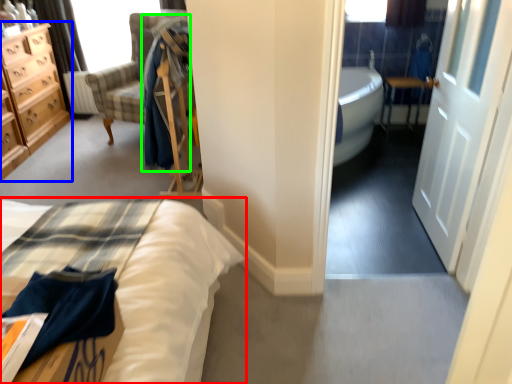
Question: Which is farther away from bed (highlighted by a red box)? chest of drawers (highlighted by a blue box) or robe (highlighted by a green box)?

Choices:
 (A) chest of drawers
 (B) robe

Answer: (A)